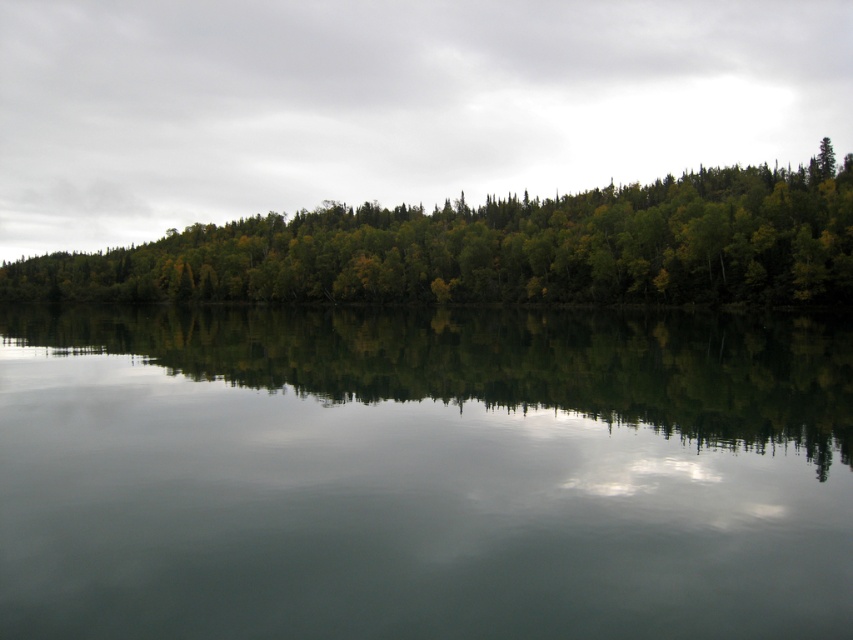
Between green reflective water at center and green leafy trees at center, which one is positioned higher?

green leafy trees at center is higher up.

Is point (155, 394) positioned after point (425, 284)?

No, it is not.

Is point (740, 412) positioned before point (850, 220)?

That is True.

Where is `green reflective water at center`? Image resolution: width=853 pixels, height=640 pixels. green reflective water at center is located at coordinates (422, 474).